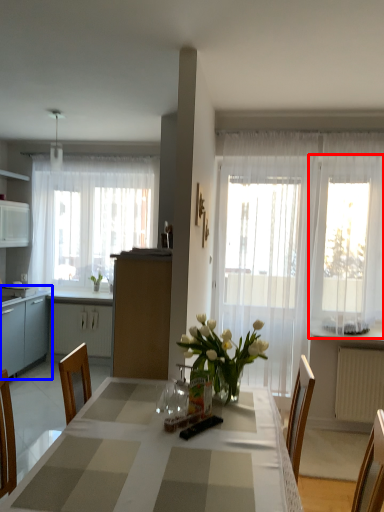
Question: Among these objects, which one is nearest to the camera, window (highlighted by a red box) or cabinetry (highlighted by a blue box)?

Choices:
 (A) window
 (B) cabinetry

Answer: (A)